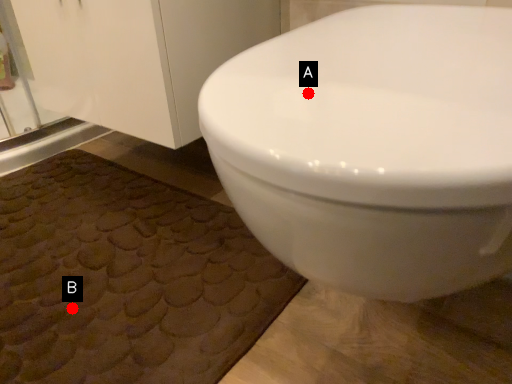
Question: Two points are circled on the image, labeled by A and B beside each circle. Which point is closer to the camera?

Choices:
 (A) A is closer
 (B) B is closer

Answer: (A)